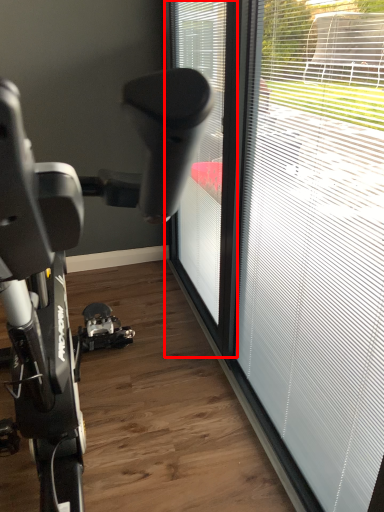
Question: From the image's perspective, considering the relative positions of window (annotated by the red box) and window in the image provided, where is window (annotated by the red box) located with respect to the staircase?

Choices:
 (A) below
 (B) above

Answer: (B)